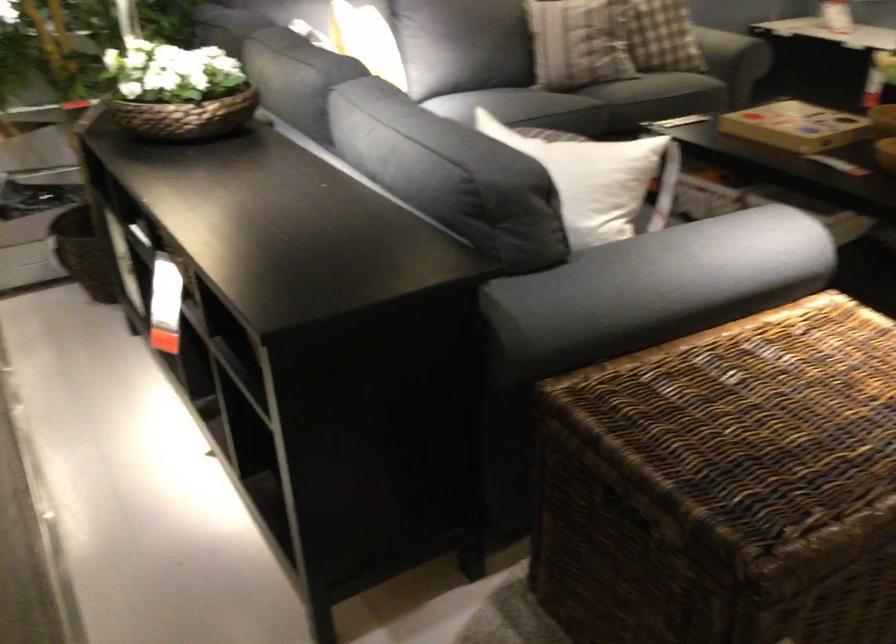
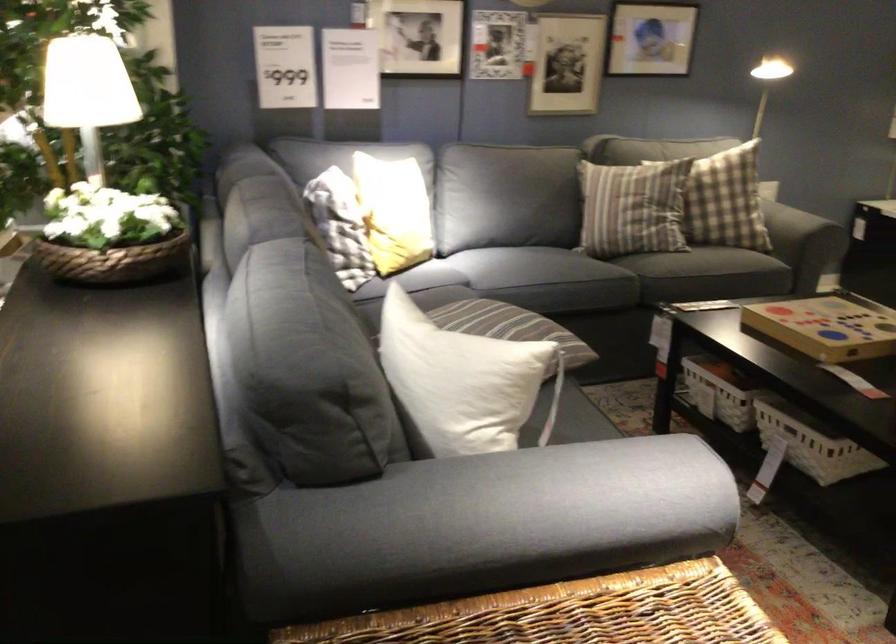
The point at (522, 106) is marked in the first image. Where is the corresponding point in the second image?

(538, 267)